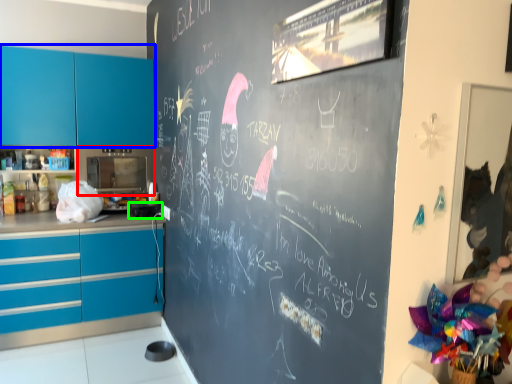
Question: Considering the real-world distances, which object is closest to appliance (highlighted by a red box)? cabinetry (highlighted by a blue box) or appliance (highlighted by a green box).

Choices:
 (A) cabinetry
 (B) appliance

Answer: (A)